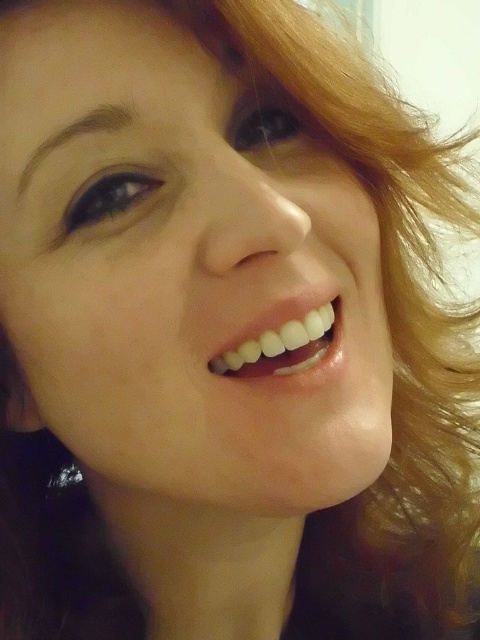
Based on the scene description, which object is taller between the smooth skin face at center and the white glossy teeth at center?

The smooth skin face at center is taller than the white glossy teeth at center according to the description.

Looking at this image, based on the scene description, if someone wants to place a small sticker on the smooth skin face at center and the white glossy teeth at center, which area would allow for a larger sticker without overlapping?

The smooth skin face at center has a larger size compared to the white glossy teeth at center, so the sticker can be placed larger on the smooth skin face at center without overlapping.